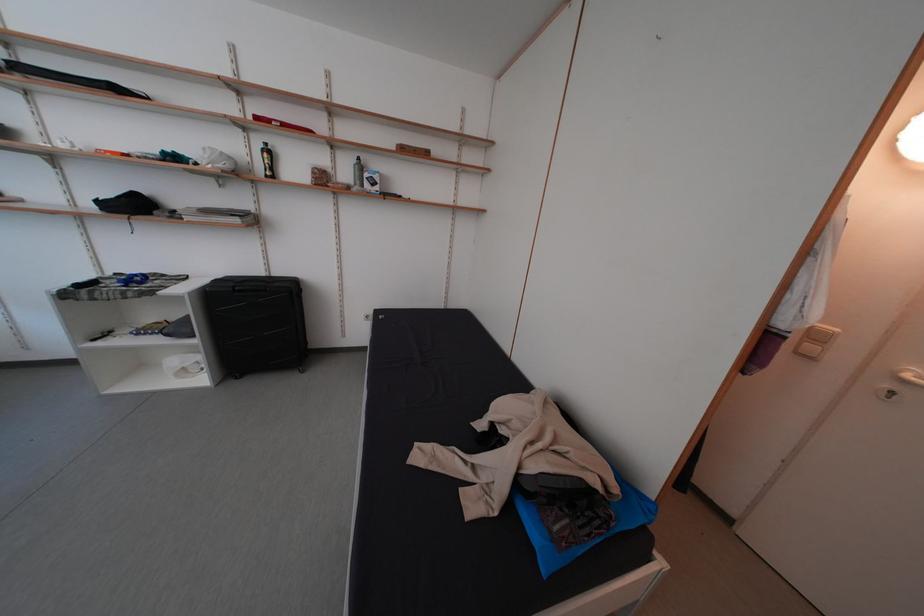
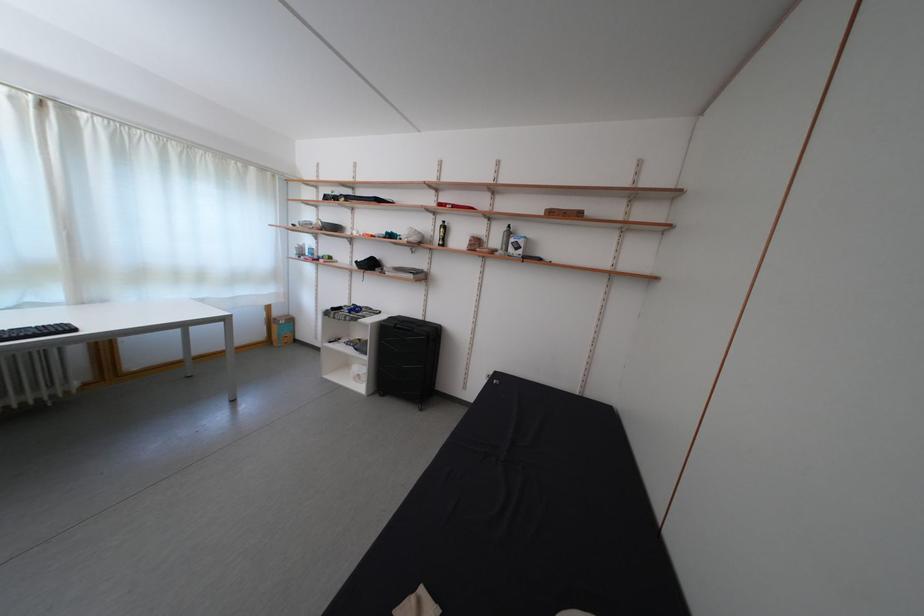
Where in the second image is the point corresponding to [354,179] from the first image?

(505, 246)